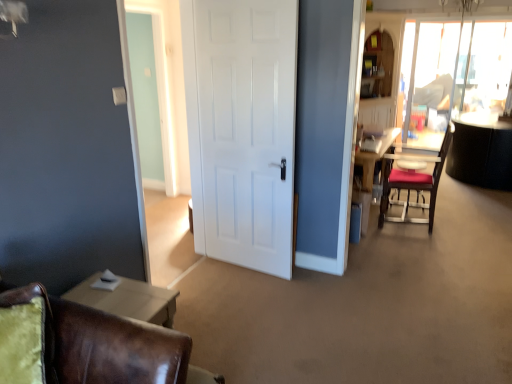
Question: Considering the positions of white matte door at center and brown leather chair at lower left, the 1th chair viewed from the left, in the image, is white matte door at center wider or thinner than brown leather chair at lower left, the 1th chair viewed from the left,?

Choices:
 (A) thin
 (B) wide

Answer: (A)

Question: Considering the positions of white matte door at center and brown leather chair at lower left, marked as the second chair in a back-to-front arrangement, in the image, is white matte door at center taller or shorter than brown leather chair at lower left, marked as the second chair in a back-to-front arrangement,?

Choices:
 (A) tall
 (B) short

Answer: (A)

Question: Which is farther from the brown leather chair at lower left, the first chair positioned from the bottom?

Choices:
 (A) transparent glass window screen at upper right
 (B) white matte door at center
 (C) velvet red chair at right, acting as the 1th chair starting from the back
 (D) velvet brown swivel chair at lower left

Answer: (A)

Question: Estimate the real-world distances between objects in this image. Which object is farther from the velvet red chair at right, the first chair when ordered from right to left?

Choices:
 (A) transparent glass window screen at upper right
 (B) brown leather chair at lower left, marked as the second chair in a back-to-front arrangement
 (C) velvet brown swivel chair at lower left
 (D) white matte door at center

Answer: (C)